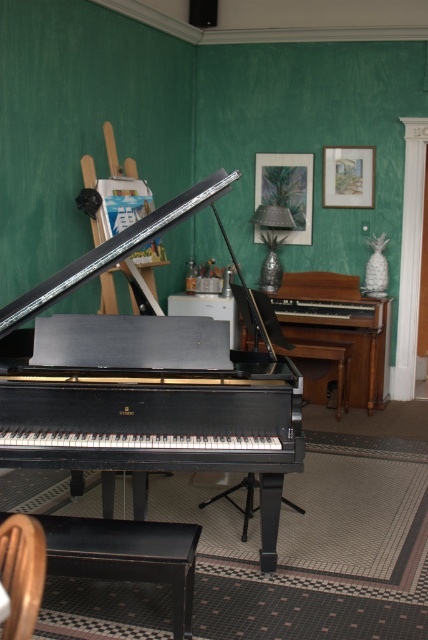
Question: Where is matte black bench at lower center located in relation to wooden picture frame at upper center in the image?

Choices:
 (A) left
 (B) right

Answer: (A)

Question: Can you confirm if metallic silver picture frame at upper center is bigger than wooden picture frame at upper center?

Choices:
 (A) yes
 (B) no

Answer: (A)

Question: Which object is closer to the camera taking this photo?

Choices:
 (A) wooden armchair at lower left
 (B) shiny black piano at center
 (C) metallic silver picture frame at upper center
 (D) matte black bench at lower center

Answer: (A)

Question: Is shiny black piano at center further to camera compared to wooden armchair at lower left?

Choices:
 (A) no
 (B) yes

Answer: (B)

Question: Which point is farther to the camera?

Choices:
 (A) metallic silver picture frame at upper center
 (B) matte black bench at lower center

Answer: (A)

Question: Among these objects, which one is nearest to the camera?

Choices:
 (A) wooden picture frame at upper center
 (B) metallic silver picture frame at upper center
 (C) shiny black piano at center

Answer: (C)